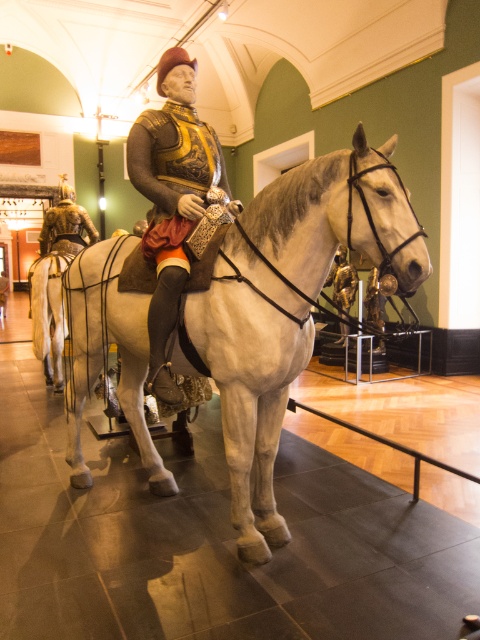
You are a tour guide explaining the exhibit to visitors. You want to point out the white glossy horse at center and the matte gold armor at center. Which object is positioned in front from your perspective?

The white glossy horse at center is closer to the viewer than the matte gold armor at center, so the white glossy horse at center is positioned in front.

You are an art curator planning to move the white glossy horse at center and the matte gold armor at center into a new exhibition space. The entrance to this space has a doorway that is 1.5 meters wide. Can both items pass through the doorway without any modifications?

The white glossy horse at center is wider than the matte gold armor at center. Since the doorway is 1.5 meters wide, we need to know the exact width of the wider item. However, the description only states their relative sizes. Without specific measurements, it is impossible to determine if both can pass through the doorway.